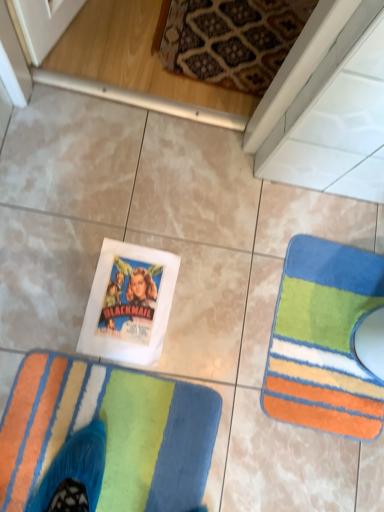
Question: Would you say multicolored plush rug at lower right, acting as the 1th towel starting from the right, is to the left or to the right of multicolored plush rug at lower left, which is the first towel from left to right, in the picture?

Choices:
 (A) right
 (B) left

Answer: (A)

Question: In terms of height, does multicolored plush rug at lower right, which appears as the 2th towel when viewed from the left, look taller or shorter compared to multicolored plush rug at lower left, which is the first towel from left to right?

Choices:
 (A) short
 (B) tall

Answer: (B)

Question: Is multicolored plush rug at lower right, which appears as the 2th towel when viewed from the left, wider or thinner than multicolored plush rug at lower left, the second towel viewed from the back?

Choices:
 (A) wide
 (B) thin

Answer: (B)

Question: From a real-world perspective, is multicolored plush rug at lower left, which is the 2th towel from right to left, positioned above or below multicolored plush rug at lower right, acting as the 1th towel starting from the right?

Choices:
 (A) above
 (B) below

Answer: (A)

Question: Would you say multicolored plush rug at lower left, which is the 2th towel from right to left, is to the left or to the right of multicolored plush rug at lower right, which appears as the 2th towel when viewed from the left, in the picture?

Choices:
 (A) right
 (B) left

Answer: (B)

Question: Considering the positions of point (178, 453) and point (292, 257), is point (178, 453) closer or farther from the camera than point (292, 257)?

Choices:
 (A) closer
 (B) farther

Answer: (A)

Question: From their relative heights in the image, would you say multicolored plush rug at lower left, which is the 2th towel from right to left, is taller or shorter than multicolored plush rug at lower right, acting as the 1th towel starting from the right?

Choices:
 (A) short
 (B) tall

Answer: (A)